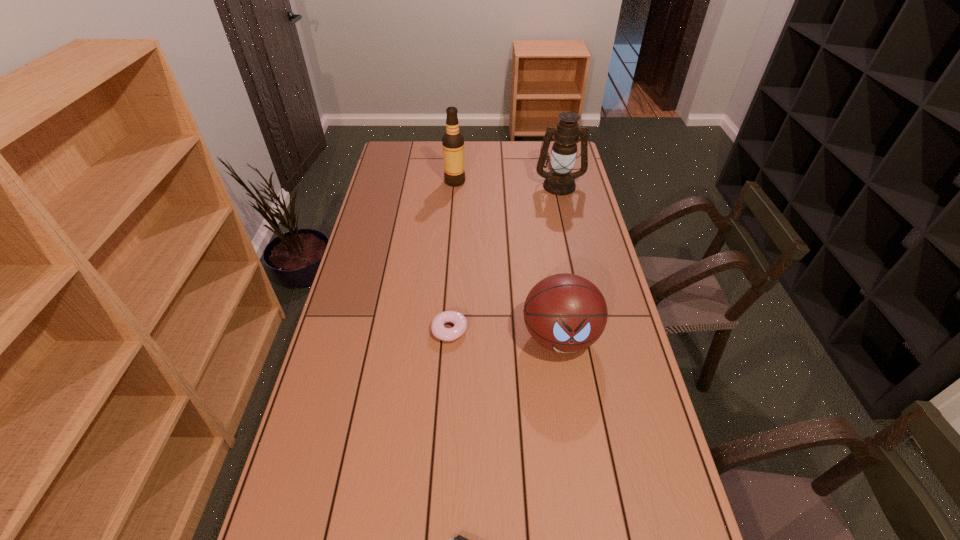
This screenshot has width=960, height=540. Find the location of `free space between the oil lamp and the fourth tallest object`. free space between the oil lamp and the fourth tallest object is located at coordinates (504, 258).

Where is `free point between the oil lamp and the fourth tallest object`? The image size is (960, 540). free point between the oil lamp and the fourth tallest object is located at coordinates (504, 258).

Choose which object is the nearest neighbor to the oil lamp. Please provide its 2D coordinates. Your answer should be formatted as a tuple, i.e. [(x, y)], where the tuple contains the x and y coordinates of a point satisfying the conditions above.

[(453, 141)]

Where is `object that can be found as the second closest to the doughnut`? The width and height of the screenshot is (960, 540). object that can be found as the second closest to the doughnut is located at coordinates (459, 539).

Locate an element on the screen. vacant region that satisfies the following two spatial constraints: 1. on the label of the doughnut; 2. on the left side of the alcohol is located at coordinates (444, 330).

I want to click on vacant position in the image that satisfies the following two spatial constraints: 1. on the label of the alcohol; 2. on the back side of the oil lamp, so click(x=455, y=185).

Find the location of a particular element. vacant position in the image that satisfies the following two spatial constraints: 1. on the label of the doughnut; 2. on the left side of the alcohol is located at coordinates (444, 330).

Image resolution: width=960 pixels, height=540 pixels. Find the location of `blank space that satisfies the following two spatial constraints: 1. on the label of the second shortest object; 2. on the right side of the alcohol`. blank space that satisfies the following two spatial constraints: 1. on the label of the second shortest object; 2. on the right side of the alcohol is located at coordinates (444, 330).

You are a GUI agent. You are given a task and a screenshot of the screen. Output one action in this format:
    pyautogui.click(x=<x>, y=<y>)
    Task: Click on the vacant area in the image that satisfies the following two spatial constraints: 1. on the label of the oil lamp; 2. on the left side of the alcohol
    The height and width of the screenshot is (540, 960).
    Given the screenshot: What is the action you would take?
    pyautogui.click(x=455, y=185)